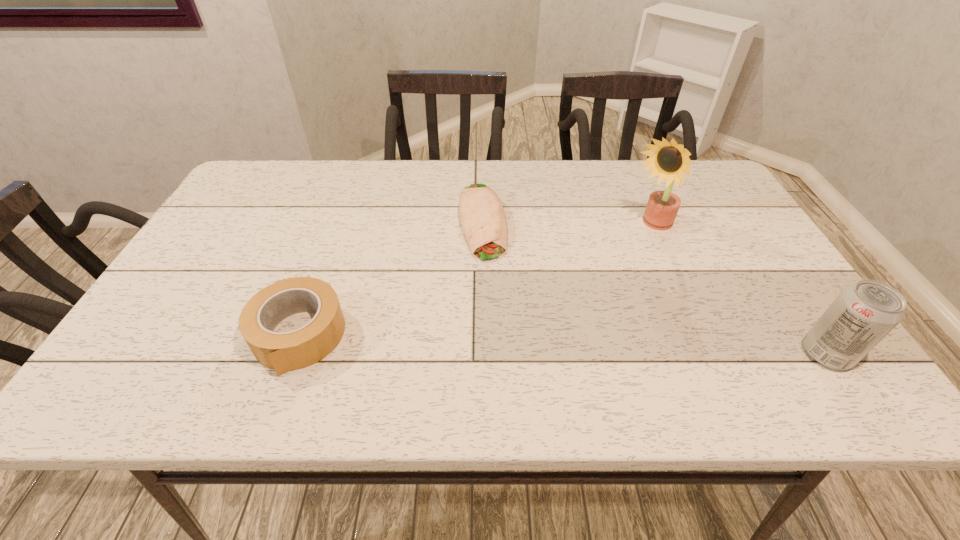
Find the location of a particular element. vacant space that is in between the rightmost object and the leftmost object is located at coordinates (563, 345).

I want to click on free space between the soda can and the second object from left to right, so click(x=655, y=287).

Locate an element on the screen. This screenshot has height=540, width=960. vacant space that's between the tallest object and the rightmost object is located at coordinates point(738,291).

Identify the location of vacant area between the second tallest object and the sunflower. Image resolution: width=960 pixels, height=540 pixels. (738, 291).

This screenshot has height=540, width=960. What are the coordinates of `object that is the closest one to the burrito` in the screenshot? It's located at (282, 351).

Select which object appears as the closest to the burrito. Please provide its 2D coordinates. Your answer should be formatted as a tuple, i.e. [(x, y)], where the tuple contains the x and y coordinates of a point satisfying the conditions above.

[(282, 351)]

Identify the location of free space in the image that satisfies the following two spatial constraints: 1. on the front side of the burrito; 2. on the left side of the second object from right to left. (483, 228).

Where is `vacant space that satisfies the following two spatial constraints: 1. at the edge of the duct tape; 2. on the left side of the soda can`? This screenshot has width=960, height=540. vacant space that satisfies the following two spatial constraints: 1. at the edge of the duct tape; 2. on the left side of the soda can is located at coordinates (292, 354).